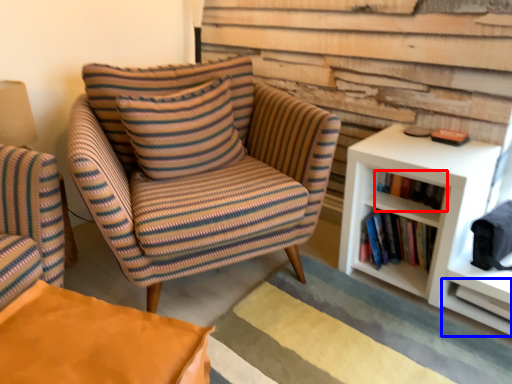
Question: Among these objects, which one is nearest to the camera, book (highlighted by a red box) or shelf (highlighted by a blue box)?

Choices:
 (A) book
 (B) shelf

Answer: (B)